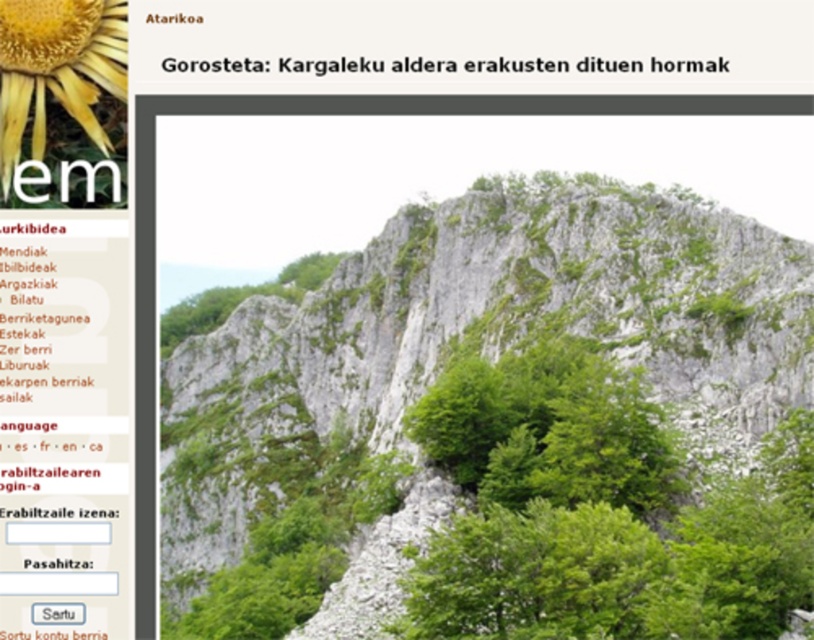
You are looking at the webpage image and want to determine which of the two points, point (77, 113) or point (327, 67), is nearer to you. Based on the image, which point is closer?

Point (77, 113) is closer to the camera than point (327, 67), so it is the closer one.

You are designing a virtual tour of this mountain scene. To place a hotspot for a pop up about the green leafy trees at center, what are their coordinates?

The green leafy trees at center are located at coordinates point (x=335, y=115).